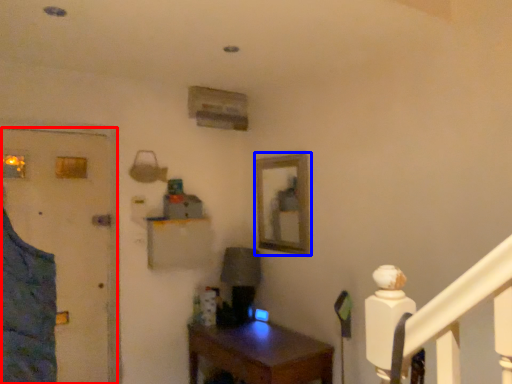
Question: Which object appears farthest to the camera in this image, door (highlighted by a red box) or picture frame (highlighted by a blue box)?

Choices:
 (A) door
 (B) picture frame

Answer: (B)